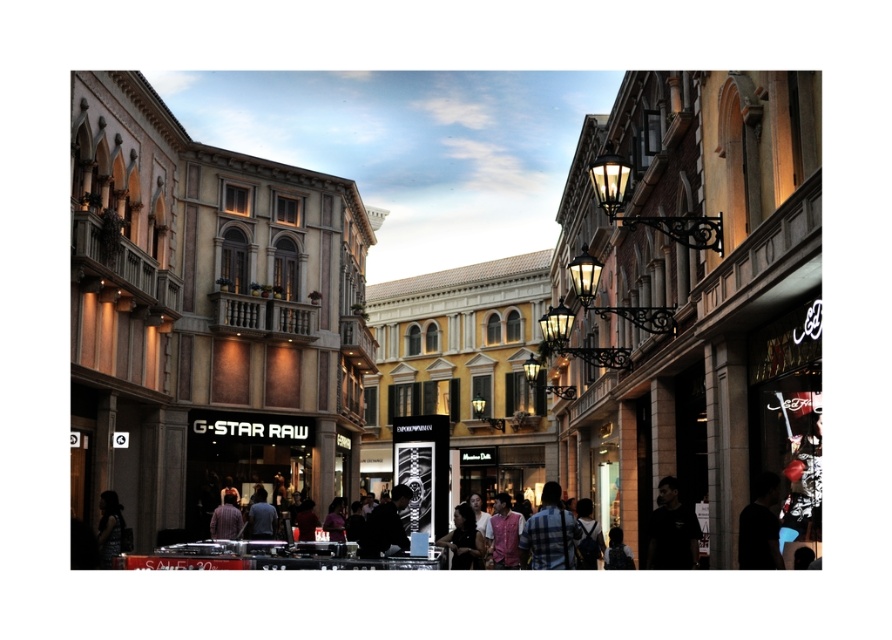
Does dark hair at lower right appear on the left side of dark gray sweater at center?

In fact, dark hair at lower right is to the right of dark gray sweater at center.

Does dark hair at lower right have a larger size compared to dark gray sweater at center?

Actually, dark hair at lower right might be smaller than dark gray sweater at center.

Where is `dark hair at lower right`? The height and width of the screenshot is (640, 892). dark hair at lower right is located at coordinates (760, 525).

Is point (106, 556) less distant than point (622, 566)?

No, (106, 556) is further to viewer.

Between point (106, 502) and point (622, 557), which one is positioned behind?

The point (106, 502) is behind.

Who is more distant from viewer, [103,556] or [629,552]?

Positioned behind is point [103,556].

Where is `silhouette fabric at lower left`? The height and width of the screenshot is (640, 892). silhouette fabric at lower left is located at coordinates (109, 529).

Does point (651, 566) lie in front of point (618, 556)?

Yes, point (651, 566) is closer to viewer.

Does black matte shirt at lower right appear on the right side of dark hair at center?

Yes, black matte shirt at lower right is to the right of dark hair at center.

Which is in front, point (670, 550) or point (612, 525)?

Positioned in front is point (670, 550).

Where is `black matte shirt at lower right`? Image resolution: width=892 pixels, height=640 pixels. black matte shirt at lower right is located at coordinates (671, 531).